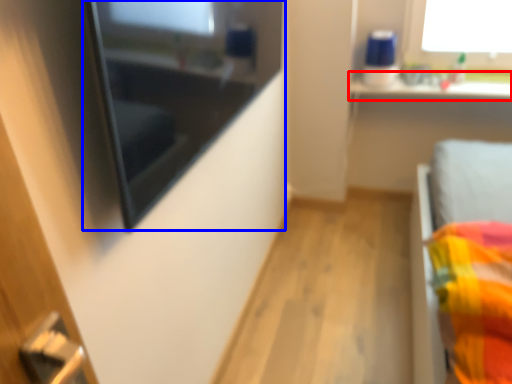
Question: Which object is closer to the camera taking this photo, window sill (highlighted by a red box) or medicine cabinet (highlighted by a blue box)?

Choices:
 (A) window sill
 (B) medicine cabinet

Answer: (B)